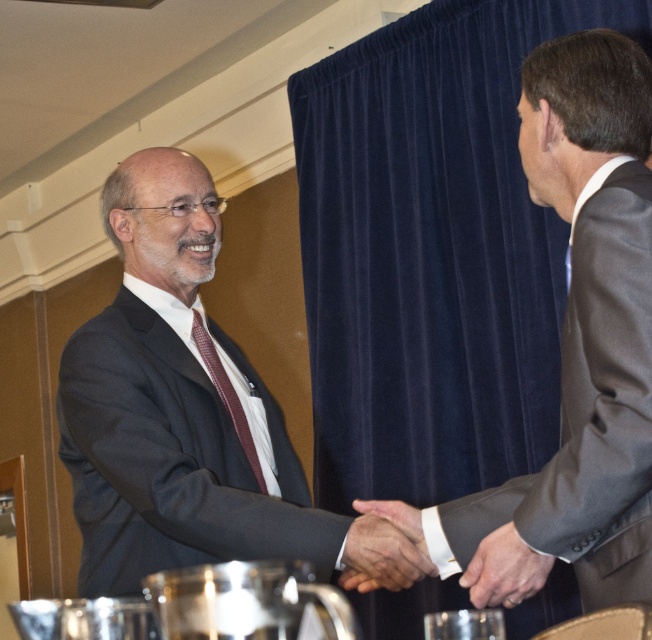
You are a photographer setting up for an event and notice the velvet blue curtain at upper center and the white leather hand at center in the frame. Which object is positioned higher in the image?

The velvet blue curtain at upper center has a greater height compared to the white leather hand at center, so the velvet blue curtain at upper center is positioned higher in the image.

You are standing in the room where the two men are shaking hands. You need to locate the matte black suit at center. Based on the coordinates provided, where would you find it?

The matte black suit at center is located at the 2D coordinates point (x=173, y=404).